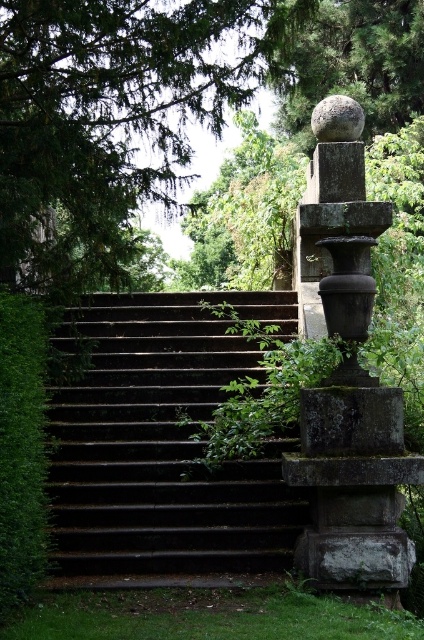
At what (x,y) coordinates should I click in order to perform the action: click on green textured sphere at upper center. Please return your answer as a coordinate pair (x, y). This screenshot has width=424, height=640. Looking at the image, I should click on (351, 61).

Is green textured sphere at upper center behind smooth gray stone at upper center?

No, green textured sphere at upper center is in front of smooth gray stone at upper center.

The height and width of the screenshot is (640, 424). Identify the location of green textured sphere at upper center. (351, 61).

Can you confirm if green leafy tree at upper left is thinner than green leafy hedge at left?

No, green leafy tree at upper left is not thinner than green leafy hedge at left.

Who is higher up, green leafy tree at upper left or green leafy hedge at left?

green leafy tree at upper left

Where is `green leafy tree at upper left`? This screenshot has height=640, width=424. green leafy tree at upper left is located at coordinates (114, 116).

Is point (272, 504) farther from viewer compared to point (320, 131)?

No, (272, 504) is in front of (320, 131).

Which is in front, point (119, 320) or point (329, 97)?

Positioned in front is point (329, 97).

This screenshot has height=640, width=424. Find the location of `dark stone stairs at center`. dark stone stairs at center is located at coordinates (164, 445).